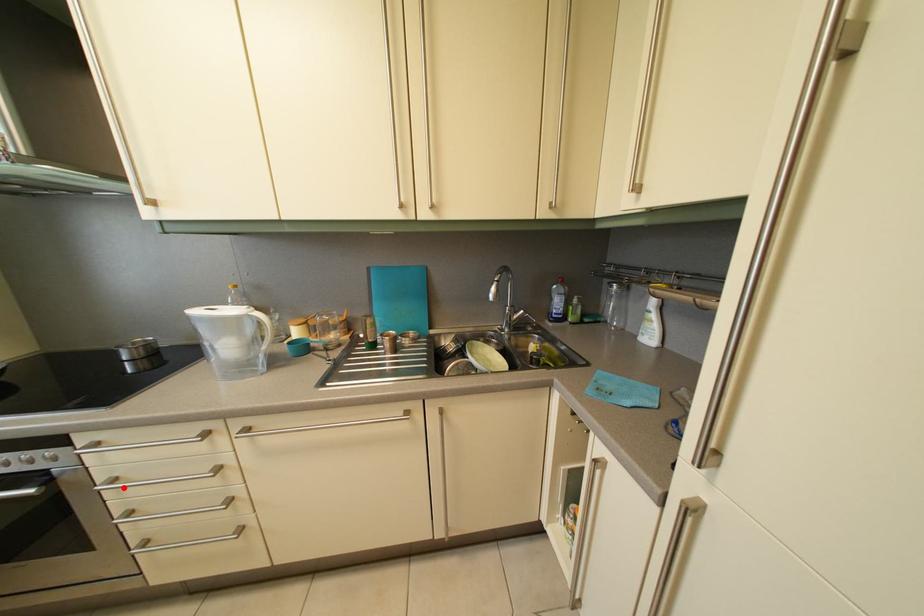
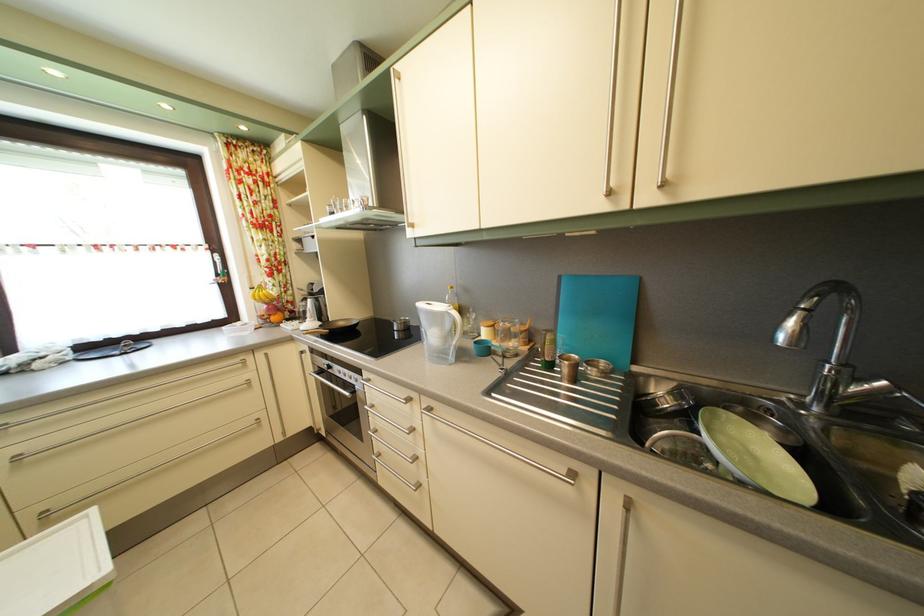
Where in the second image is the point corresponding to the highlighted location from the first image?

(381, 414)